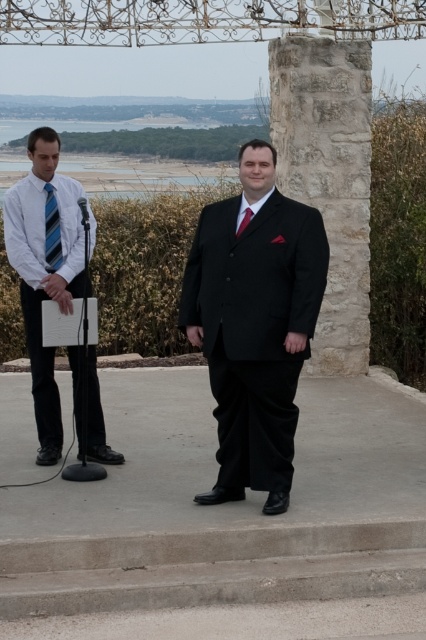
Question: Is black satin suit at center below white striped shirt at left?

Choices:
 (A) no
 (B) yes

Answer: (B)

Question: Can you confirm if black satin suit at center is positioned to the right of blue striped tie at left?

Choices:
 (A) no
 (B) yes

Answer: (B)

Question: From the image, what is the correct spatial relationship of black satin suit at center in relation to blue striped tie at left?

Choices:
 (A) left
 (B) right

Answer: (B)

Question: Which point is closer to the camera taking this photo?

Choices:
 (A) (48, 182)
 (B) (316, 58)

Answer: (A)

Question: Which object appears farthest from the camera in this image?

Choices:
 (A) shiny red tie at center
 (B) black satin suit at center
 (C) stone at center

Answer: (C)

Question: Considering the real-world distances, which object is closest to the blue striped tie at left?

Choices:
 (A) stone at center
 (B) shiny red tie at center

Answer: (B)